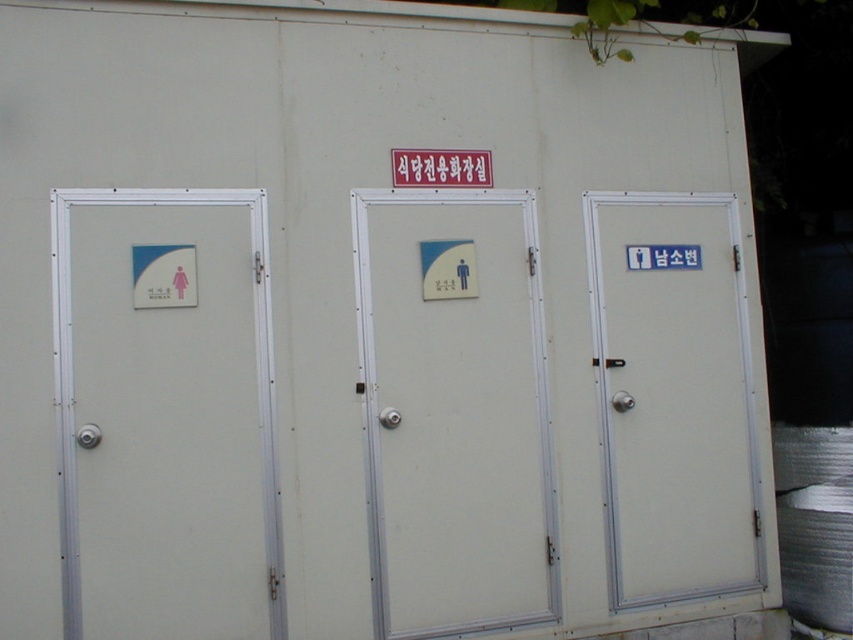
You are a visitor at an outdoor event and need to find the dining hall restroom. You see the white matte door at right and the white plastic sign at center. Which direction should you look to find the dining hall restroom?

The white matte door at right is positioned under the white plastic sign at center, which indicates the dining hall restroom. Therefore, you should look toward the white matte door at right located beneath the white plastic sign at center to find the dining hall restroom.

You are a maintenance worker who needs to replace the sign above the central toilet. The new sign you have is the same size as the white plastic sign at center. Will the new sign fit on the white matte door at center without overlapping its edges?

The white matte door at center has a larger size compared to the white plastic sign at center. Since the new sign is the same size as the existing one, it will fit on the white matte door at center without overlapping the edges.